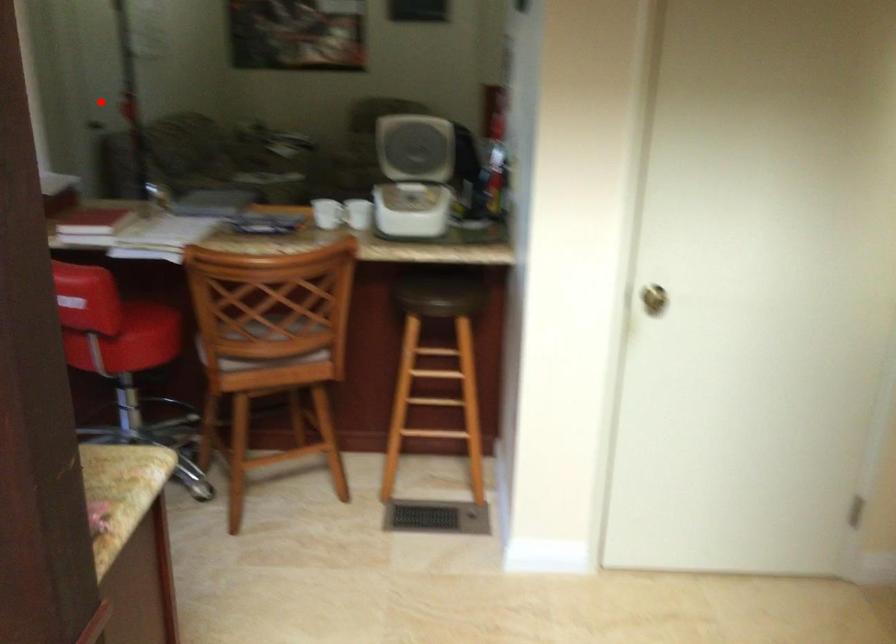
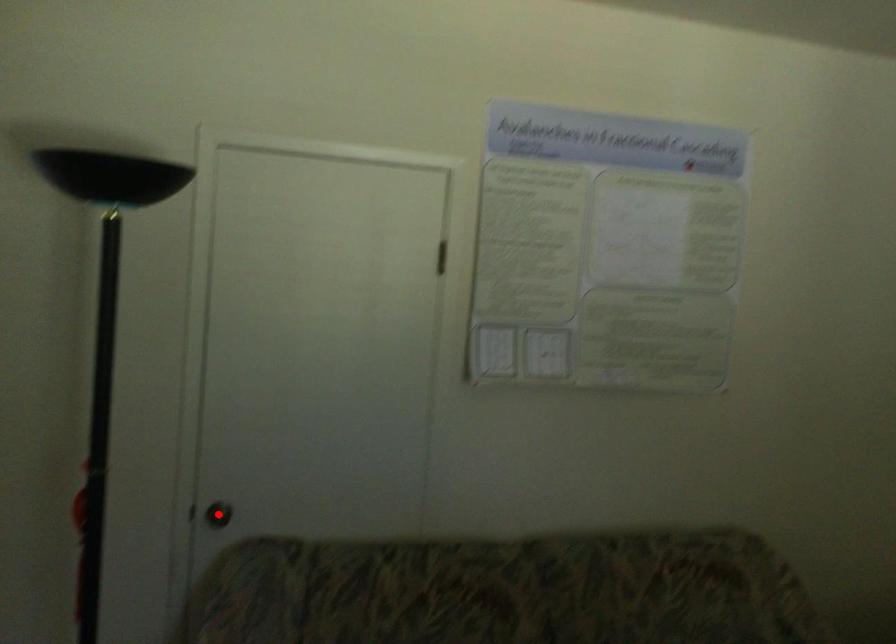
I am providing you with two images of the same scene from different viewpoints. A red point is marked on the first image and another point is marked on the second image. Is the marked point in image1 the same physical position as the marked point in image2?

Yes